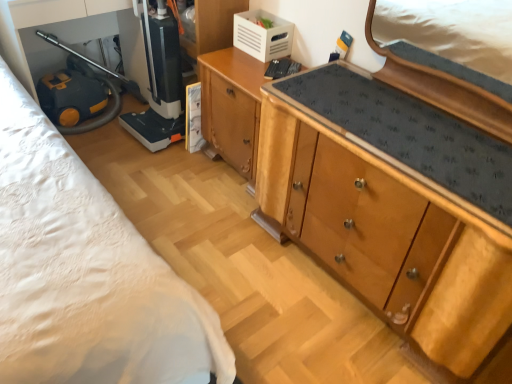
The height and width of the screenshot is (384, 512). Describe the element at coordinates (262, 35) in the screenshot. I see `white plastic crate at upper center, the 1th appliance positioned from the right` at that location.

What is the approximate height of white plastic crate at upper center, which is counted as the 2th appliance, starting from the left?

6.20 inches.

This screenshot has height=384, width=512. What do you see at coordinates (154, 76) in the screenshot? I see `black plastic vacuum cleaner at lower left, the 2th appliance in the right-to-left sequence` at bounding box center [154, 76].

Where is `white plastic crate at upper center, the 1th appliance positioned from the right`? This screenshot has width=512, height=384. white plastic crate at upper center, the 1th appliance positioned from the right is located at coordinates (262, 35).

Is point (244, 159) in front of point (233, 24)?

Yes, point (244, 159) is closer to viewer.

Between wooden cabinet at center, arranged as the 1th cabinetry when viewed from the left, and white plastic crate at upper center, the 1th appliance positioned from the right, which one has more height?

wooden cabinet at center, arranged as the 1th cabinetry when viewed from the left.

In the image, is wooden cabinet at center, arranged as the 1th cabinetry when viewed from the left, positioned in front of or behind white plastic crate at upper center, the 1th appliance positioned from the right?

Visually, wooden cabinet at center, arranged as the 1th cabinetry when viewed from the left, is located in front of white plastic crate at upper center, the 1th appliance positioned from the right.

Locate an element on the screen. This screenshot has width=512, height=384. the 2nd cabinetry directly beneath the white plastic crate at upper center, the 1th appliance positioned from the right (from a real-world perspective) is located at coordinates (232, 106).

Considering the sizes of wooden cabinet at center, placed as the 2th cabinetry when sorted from left to right, and wooden cabinet at center, arranged as the 1th cabinetry when viewed from the left, in the image, is wooden cabinet at center, placed as the 2th cabinetry when sorted from left to right, bigger or smaller than wooden cabinet at center, arranged as the 1th cabinetry when viewed from the left,?

In the image, wooden cabinet at center, placed as the 2th cabinetry when sorted from left to right, appears to be larger than wooden cabinet at center, arranged as the 1th cabinetry when viewed from the left.

Between wooden cabinet at center, placed as the 2th cabinetry when sorted from left to right, and wooden cabinet at center, arranged as the 2th cabinetry when viewed from the right, which one has larger width?

Wider between the two is wooden cabinet at center, placed as the 2th cabinetry when sorted from left to right.

Is wooden cabinet at center, placed as the 2th cabinetry when sorted from left to right, taller or shorter than wooden cabinet at center, arranged as the 2th cabinetry when viewed from the right?

Considering their sizes, wooden cabinet at center, placed as the 2th cabinetry when sorted from left to right, has more height than wooden cabinet at center, arranged as the 2th cabinetry when viewed from the right.

Is point (437, 156) closer or farther from the camera than point (246, 94)?

Clearly, point (437, 156) is closer to the camera than point (246, 94).

Based on their sizes in the image, would you say wooden cabinet at center, arranged as the 1th cabinetry when viewed from the left, is bigger or smaller than black plastic vacuum cleaner at lower left, the 2th appliance in the right-to-left sequence?

In the image, wooden cabinet at center, arranged as the 1th cabinetry when viewed from the left, appears to be larger than black plastic vacuum cleaner at lower left, the 2th appliance in the right-to-left sequence.

From the image's perspective, between wooden cabinet at center, arranged as the 1th cabinetry when viewed from the left, and black plastic vacuum cleaner at lower left, the 2th appliance in the right-to-left sequence, which one is located above?

black plastic vacuum cleaner at lower left, the 2th appliance in the right-to-left sequence.

Can you confirm if wooden cabinet at center, arranged as the 1th cabinetry when viewed from the left, is shorter than black plastic vacuum cleaner at lower left, acting as the 1th appliance starting from the left?

Indeed, wooden cabinet at center, arranged as the 1th cabinetry when viewed from the left, has a lesser height compared to black plastic vacuum cleaner at lower left, acting as the 1th appliance starting from the left.

Considering the relative positions of wooden cabinet at center, arranged as the 2th cabinetry when viewed from the right, and black plastic vacuum cleaner at lower left, the 2th appliance in the right-to-left sequence, in the image provided, is wooden cabinet at center, arranged as the 2th cabinetry when viewed from the right, behind black plastic vacuum cleaner at lower left, the 2th appliance in the right-to-left sequence,?

No, it is not.

Does white plastic crate at upper center, the 1th appliance positioned from the right, turn towards wooden cabinet at center, placed as the 2th cabinetry when sorted from left to right?

No, white plastic crate at upper center, the 1th appliance positioned from the right, is not facing towards wooden cabinet at center, placed as the 2th cabinetry when sorted from left to right.

How many degrees apart are the facing directions of white plastic crate at upper center, the 1th appliance positioned from the right, and wooden cabinet at center, placed as the 2th cabinetry when sorted from left to right?

There is a 0.724-degree angle between the facing directions of white plastic crate at upper center, the 1th appliance positioned from the right, and wooden cabinet at center, placed as the 2th cabinetry when sorted from left to right.

Consider the image. From a real-world perspective, is white plastic crate at upper center, which is counted as the 2th appliance, starting from the left, on wooden cabinet at center, which appears as the 1th cabinetry when viewed from the right?

Indeed, from a real-world perspective, white plastic crate at upper center, which is counted as the 2th appliance, starting from the left, stands above wooden cabinet at center, which appears as the 1th cabinetry when viewed from the right.

Is white plastic crate at upper center, the 1th appliance positioned from the right, smaller than wooden cabinet at center, which appears as the 1th cabinetry when viewed from the right?

Yes.

Considering the sizes of objects black plastic vacuum cleaner at lower left, acting as the 1th appliance starting from the left, and wooden cabinet at center, arranged as the 1th cabinetry when viewed from the left, in the image provided, who is wider, black plastic vacuum cleaner at lower left, acting as the 1th appliance starting from the left, or wooden cabinet at center, arranged as the 1th cabinetry when viewed from the left,?

Wider between the two is wooden cabinet at center, arranged as the 1th cabinetry when viewed from the left.

In the scene shown: From their relative heights in the image, would you say black plastic vacuum cleaner at lower left, acting as the 1th appliance starting from the left, is taller or shorter than wooden cabinet at center, arranged as the 1th cabinetry when viewed from the left?

In the image, black plastic vacuum cleaner at lower left, acting as the 1th appliance starting from the left, appears to be taller than wooden cabinet at center, arranged as the 1th cabinetry when viewed from the left.

At what (x,y) coordinates should I click in order to perform the action: click on appliance that appears on the left of wooden cabinet at center, arranged as the 1th cabinetry when viewed from the left. Please return your answer as a coordinate pair (x, y). Looking at the image, I should click on (154, 76).

Which is in front, point (173, 41) or point (208, 138)?

The point (173, 41) is in front.

Would you consider white plastic crate at upper center, which is counted as the 2th appliance, starting from the left, to be distant from wooden cabinet at center, arranged as the 1th cabinetry when viewed from the left?

No, white plastic crate at upper center, which is counted as the 2th appliance, starting from the left, is in close proximity to wooden cabinet at center, arranged as the 1th cabinetry when viewed from the left.

From a real-world perspective, is white plastic crate at upper center, the 1th appliance positioned from the right, positioned over wooden cabinet at center, arranged as the 2th cabinetry when viewed from the right, based on gravity?

Yes, from a real-world perspective, white plastic crate at upper center, the 1th appliance positioned from the right, is over wooden cabinet at center, arranged as the 2th cabinetry when viewed from the right

Locate an element on the screen. The height and width of the screenshot is (384, 512). the 1st cabinetry below the white plastic crate at upper center, the 1th appliance positioned from the right (from the image's perspective) is located at coordinates (232, 106).

From the image's perspective, relative to wooden cabinet at center, arranged as the 1th cabinetry when viewed from the left, is white plastic crate at upper center, which is counted as the 2th appliance, starting from the left, above or below?

Based on their image positions, white plastic crate at upper center, which is counted as the 2th appliance, starting from the left, is located above wooden cabinet at center, arranged as the 1th cabinetry when viewed from the left.

Is wooden cabinet at center, which appears as the 1th cabinetry when viewed from the right, looking in the opposite direction of black plastic vacuum cleaner at lower left, the 2th appliance in the right-to-left sequence?

wooden cabinet at center, which appears as the 1th cabinetry when viewed from the right, does not have its back to black plastic vacuum cleaner at lower left, the 2th appliance in the right-to-left sequence.

Can you confirm if wooden cabinet at center, placed as the 2th cabinetry when sorted from left to right, is smaller than black plastic vacuum cleaner at lower left, the 2th appliance in the right-to-left sequence?

No, wooden cabinet at center, placed as the 2th cabinetry when sorted from left to right, is not smaller than black plastic vacuum cleaner at lower left, the 2th appliance in the right-to-left sequence.

From the image's perspective, starting from the black plastic vacuum cleaner at lower left, acting as the 1th appliance starting from the left, which cabinetry is the 2nd one below? Please provide its 2D coordinates.

[(394, 205)]

From a real-world perspective, relative to black plastic vacuum cleaner at lower left, acting as the 1th appliance starting from the left, is wooden cabinet at center, placed as the 2th cabinetry when sorted from left to right, vertically above or below?

Clearly, from a real-world perspective, wooden cabinet at center, placed as the 2th cabinetry when sorted from left to right, is below black plastic vacuum cleaner at lower left, acting as the 1th appliance starting from the left.

From a real-world perspective, which cabinetry is the 2nd one underneath the white plastic crate at upper center, which is counted as the 2th appliance, starting from the left? Please provide its 2D coordinates.

[(232, 106)]

Identify the location of cabinetry above the wooden cabinet at center, placed as the 2th cabinetry when sorted from left to right (from the image's perspective). (x=232, y=106).

Estimate the real-world distances between objects in this image. Which object is further from black plastic vacuum cleaner at lower left, the 2th appliance in the right-to-left sequence, white plastic crate at upper center, the 1th appliance positioned from the right, or wooden cabinet at center, arranged as the 1th cabinetry when viewed from the left?

white plastic crate at upper center, the 1th appliance positioned from the right, is positioned further to the anchor black plastic vacuum cleaner at lower left, the 2th appliance in the right-to-left sequence.

From the image, which object appears to be nearer to wooden cabinet at center, placed as the 2th cabinetry when sorted from left to right, black plastic vacuum cleaner at lower left, the 2th appliance in the right-to-left sequence, or white plastic crate at upper center, the 1th appliance positioned from the right?

white plastic crate at upper center, the 1th appliance positioned from the right.

Based on their spatial positions, is wooden cabinet at center, which appears as the 1th cabinetry when viewed from the right, or black plastic vacuum cleaner at lower left, acting as the 1th appliance starting from the left, further from wooden cabinet at center, arranged as the 1th cabinetry when viewed from the left?

wooden cabinet at center, which appears as the 1th cabinetry when viewed from the right, is positioned further to the anchor wooden cabinet at center, arranged as the 1th cabinetry when viewed from the left.

Which object lies nearer to the anchor point white plastic crate at upper center, the 1th appliance positioned from the right, black plastic vacuum cleaner at lower left, the 2th appliance in the right-to-left sequence, or wooden cabinet at center, which appears as the 1th cabinetry when viewed from the right?

black plastic vacuum cleaner at lower left, the 2th appliance in the right-to-left sequence.

Considering their positions, is black plastic vacuum cleaner at lower left, the 2th appliance in the right-to-left sequence, positioned closer to wooden cabinet at center, which appears as the 1th cabinetry when viewed from the right, than wooden cabinet at center, arranged as the 1th cabinetry when viewed from the left?

Among the two, wooden cabinet at center, arranged as the 1th cabinetry when viewed from the left, is located nearer to wooden cabinet at center, which appears as the 1th cabinetry when viewed from the right.

Considering their positions, is white plastic crate at upper center, which is counted as the 2th appliance, starting from the left, positioned closer to wooden cabinet at center, arranged as the 2th cabinetry when viewed from the right, than wooden cabinet at center, which appears as the 1th cabinetry when viewed from the right?

white plastic crate at upper center, which is counted as the 2th appliance, starting from the left.

Estimate the real-world distances between objects in this image. Which object is closer to white plastic crate at upper center, the 1th appliance positioned from the right, wooden cabinet at center, arranged as the 1th cabinetry when viewed from the left, or black plastic vacuum cleaner at lower left, the 2th appliance in the right-to-left sequence?

Based on the image, wooden cabinet at center, arranged as the 1th cabinetry when viewed from the left, appears to be nearer to white plastic crate at upper center, the 1th appliance positioned from the right.

Based on their spatial positions, is white plastic crate at upper center, which is counted as the 2th appliance, starting from the left, or black plastic vacuum cleaner at lower left, acting as the 1th appliance starting from the left, further from wooden cabinet at center, placed as the 2th cabinetry when sorted from left to right?

black plastic vacuum cleaner at lower left, acting as the 1th appliance starting from the left, is positioned further to the anchor wooden cabinet at center, placed as the 2th cabinetry when sorted from left to right.

This screenshot has width=512, height=384. Identify the location of appliance positioned between wooden cabinet at center, placed as the 2th cabinetry when sorted from left to right, and white plastic crate at upper center, which is counted as the 2th appliance, starting from the left, from near to far. (154, 76).

Identify the location of cabinetry positioned between wooden cabinet at center, placed as the 2th cabinetry when sorted from left to right, and white plastic crate at upper center, which is counted as the 2th appliance, starting from the left, from near to far. Image resolution: width=512 pixels, height=384 pixels. (232, 106).

At what (x,y) coordinates should I click in order to perform the action: click on cabinetry located between black plastic vacuum cleaner at lower left, the 2th appliance in the right-to-left sequence, and wooden cabinet at center, which appears as the 1th cabinetry when viewed from the right, in the left-right direction. Please return your answer as a coordinate pair (x, y). The height and width of the screenshot is (384, 512). Looking at the image, I should click on (232, 106).

Where is `cabinetry located between black plastic vacuum cleaner at lower left, the 2th appliance in the right-to-left sequence, and white plastic crate at upper center, which is counted as the 2th appliance, starting from the left, in the left-right direction`? cabinetry located between black plastic vacuum cleaner at lower left, the 2th appliance in the right-to-left sequence, and white plastic crate at upper center, which is counted as the 2th appliance, starting from the left, in the left-right direction is located at coordinates (232, 106).